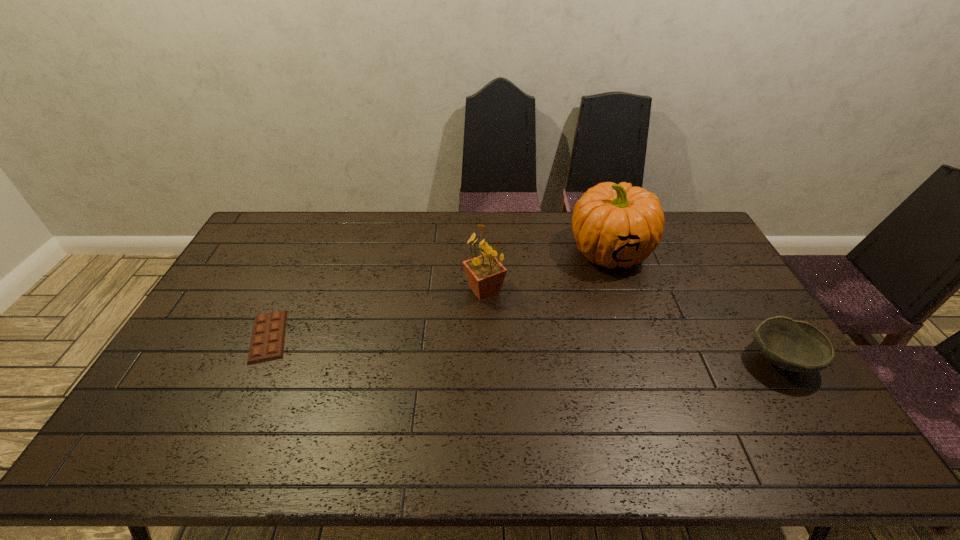
Find the location of a particular element. This screenshot has width=960, height=540. chocolate bar is located at coordinates (267, 342).

I want to click on the leftmost object, so point(267,342).

The image size is (960, 540). Find the location of `bowl`. bowl is located at coordinates (792, 345).

Identify the location of the rightmost object. (792, 345).

This screenshot has height=540, width=960. I want to click on the third object from left to right, so click(613, 224).

The height and width of the screenshot is (540, 960). Find the location of `the second object from left to right`. the second object from left to right is located at coordinates (485, 274).

Locate an element on the screen. This screenshot has height=540, width=960. free region located on the right of the chocolate bar is located at coordinates (340, 336).

The width and height of the screenshot is (960, 540). I want to click on free space located on the back of the bowl, so click(x=711, y=250).

You are a GUI agent. You are given a task and a screenshot of the screen. Output one action in this format:
    pyautogui.click(x=<x>, y=<y>)
    Task: Click on the free space located 0.260m on the surface of the second object from right to left
    
    Given the screenshot: What is the action you would take?
    pyautogui.click(x=536, y=309)

Where is `free space located on the surface of the second object from right to left`? This screenshot has width=960, height=540. free space located on the surface of the second object from right to left is located at coordinates (536, 309).